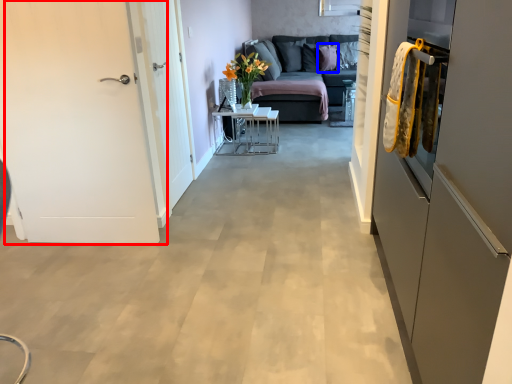
Question: Which of the following is the farthest to the observer, door (highlighted by a red box) or pillow (highlighted by a blue box)?

Choices:
 (A) door
 (B) pillow

Answer: (B)